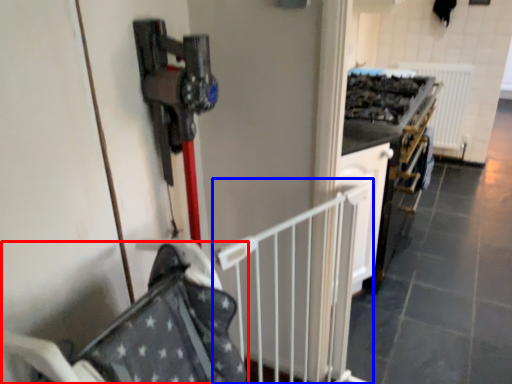
Question: Among these objects, which one is nearest to the camera, baby carriage (highlighted by a red box) or rail (highlighted by a blue box)?

Choices:
 (A) baby carriage
 (B) rail

Answer: (A)